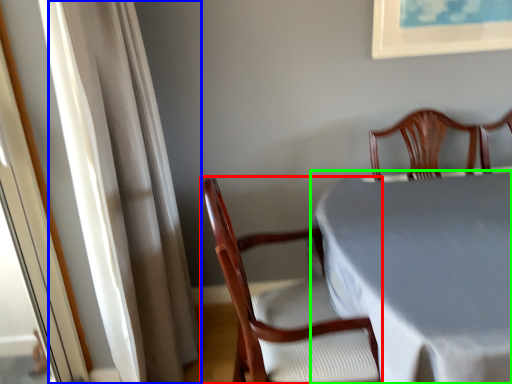
Question: Estimate the real-world distances between objects in this image. Which object is closer to chair (highlighted by a red box), curtain (highlighted by a blue box) or table (highlighted by a green box)?

Choices:
 (A) curtain
 (B) table

Answer: (B)